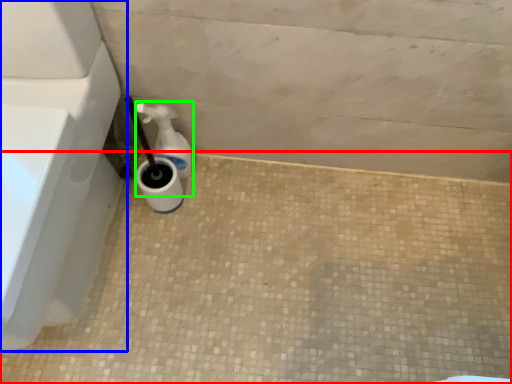
Question: Which is nearer to the concrete (highlighted by a red box)? bath (highlighted by a blue box) or soap dispenser (highlighted by a green box).

Choices:
 (A) bath
 (B) soap dispenser

Answer: (A)